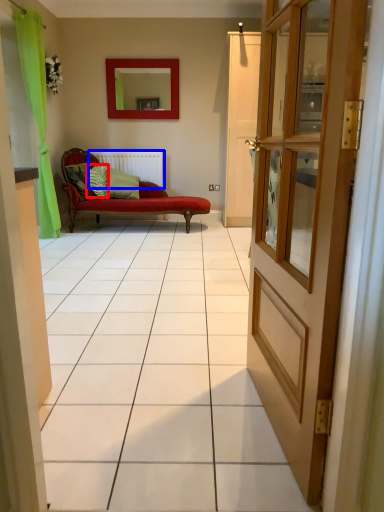
Question: Which of the following is the farthest to the observer, pillow (highlighted by a red box) or radiator (highlighted by a blue box)?

Choices:
 (A) pillow
 (B) radiator

Answer: (B)